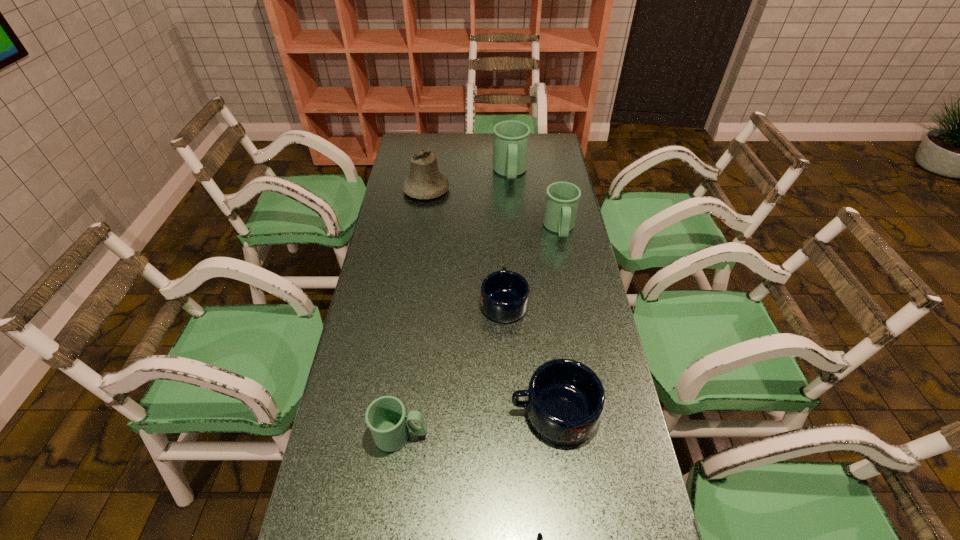
Find the location of a particular element. This screenshot has height=540, width=960. vacant space that is in between the second nearest blue mug and the nearest green mug is located at coordinates pyautogui.click(x=477, y=423).

Choose which object is the fifth nearest neighbor to the second green mug from right to left. Please provide its 2D coordinates. Your answer should be formatted as a tuple, i.e. [(x, y)], where the tuple contains the x and y coordinates of a point satisfying the conditions above.

[(385, 416)]

Find the location of a particular element. The height and width of the screenshot is (540, 960). object that can be found as the closest to the second smallest green mug is located at coordinates (510, 149).

Where is `mug that stands as the closest to the fourth nearest mug`? mug that stands as the closest to the fourth nearest mug is located at coordinates (565, 400).

Identify which mug is the third nearest to the bell. Please provide its 2D coordinates. Your answer should be formatted as a tuple, i.e. [(x, y)], where the tuple contains the x and y coordinates of a point satisfying the conditions above.

[(504, 297)]

This screenshot has height=540, width=960. In order to click on the third closest green mug to the second biggest blue mug in this screenshot , I will do pyautogui.click(x=510, y=149).

Locate which green mug ranks second in proximity to the smallest green mug. Please provide its 2D coordinates. Your answer should be formatted as a tuple, i.e. [(x, y)], where the tuple contains the x and y coordinates of a point satisfying the conditions above.

[(510, 149)]

This screenshot has height=540, width=960. I want to click on blue mug that stands as the closest to the biggest blue mug, so click(504, 297).

Where is `blue mug that is the second nearest to the biggest blue mug`? Image resolution: width=960 pixels, height=540 pixels. blue mug that is the second nearest to the biggest blue mug is located at coordinates (539, 539).

This screenshot has height=540, width=960. In order to click on vacant space that satisfies the following two spatial constraints: 1. on the side of the biggest green mug with the handle; 2. on the side of the smallest green mug with the handle in this screenshot , I will do `click(532, 435)`.